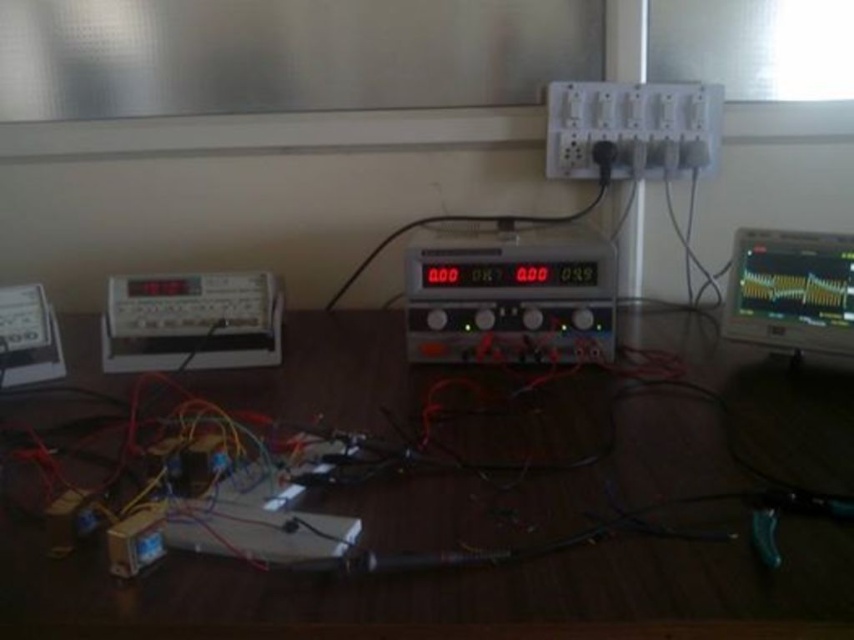
Does black plastic multimeter at center have a larger size compared to matte gray digital meter at left?

Indeed, black plastic multimeter at center has a larger size compared to matte gray digital meter at left.

Is black plastic multimeter at center to the right of matte gray digital meter at left from the viewer's perspective?

Yes, black plastic multimeter at center is to the right of matte gray digital meter at left.

Between point (565, 276) and point (108, 360), which one is positioned behind?

Point (108, 360)

You are a GUI agent. You are given a task and a screenshot of the screen. Output one action in this format:
    pyautogui.click(x=<x>, y=<y>)
    Task: Click on the black plastic multimeter at center
    The height and width of the screenshot is (640, 854).
    Given the screenshot: What is the action you would take?
    pyautogui.click(x=510, y=296)

Who is more forward, (750, 577) or (268, 342)?

Point (750, 577) is more forward.

Between point (712, 384) and point (252, 307), which one is positioned behind?

Point (252, 307)

Where is `wooden table at center`? The height and width of the screenshot is (640, 854). wooden table at center is located at coordinates (442, 586).

Describe the element at coordinates (442, 586) in the screenshot. I see `wooden table at center` at that location.

Which is more to the left, wooden table at center or matte black monitor at right?

Positioned to the left is wooden table at center.

Where is `wooden table at center`? The width and height of the screenshot is (854, 640). wooden table at center is located at coordinates (442, 586).